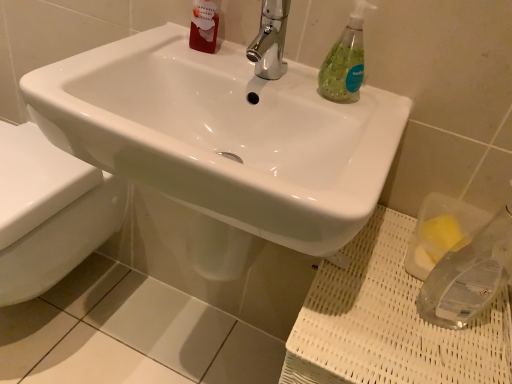
Describe the element at coordinates (389, 322) in the screenshot. I see `clear plastic sponge at lower right` at that location.

Identify the location of translucent red liquid at upper left. (204, 25).

In order to click on white glossy toilet at lower left in this screenshot , I will do `click(49, 212)`.

From a real-world perspective, is clear plastic sponge at lower right above or below chrome metallic faucet at upper center?

From a real-world perspective, clear plastic sponge at lower right is physically below chrome metallic faucet at upper center.

In terms of size, does clear plastic sponge at lower right appear bigger or smaller than chrome metallic faucet at upper center?

Clearly, clear plastic sponge at lower right is larger in size than chrome metallic faucet at upper center.

Considering the sizes of objects clear plastic sponge at lower right and chrome metallic faucet at upper center in the image provided, who is wider, clear plastic sponge at lower right or chrome metallic faucet at upper center?

clear plastic sponge at lower right is wider.

From the image's perspective, is clear plastic sponge at lower right under chrome metallic faucet at upper center?

Correct, clear plastic sponge at lower right appears lower than chrome metallic faucet at upper center in the image.

Can you tell me how much white glossy toilet at lower left and green translucent soap dispenser at upper right differ in facing direction?

The facing directions of white glossy toilet at lower left and green translucent soap dispenser at upper right are 0.241 degrees apart.

Is point (73, 256) closer or farther from the camera than point (355, 38)?

Point (73, 256).

Can you confirm if white glossy toilet at lower left is bigger than green translucent soap dispenser at upper right?

Yes, white glossy toilet at lower left is bigger than green translucent soap dispenser at upper right.

Is green translucent soap dispenser at upper right at the back of white glossy toilet at lower left?

No, white glossy toilet at lower left is not facing away from green translucent soap dispenser at upper right.

Is there a large distance between white glossy toilet at lower left and clear plastic sponge at lower right?

white glossy toilet at lower left is near clear plastic sponge at lower right, not far away.

Where is `toilet that is under the clear plastic sponge at lower right (from a real-world perspective)`? toilet that is under the clear plastic sponge at lower right (from a real-world perspective) is located at coordinates (49, 212).

Can you confirm if white glossy toilet at lower left is bigger than clear plastic sponge at lower right?

Indeed, white glossy toilet at lower left has a larger size compared to clear plastic sponge at lower right.

From a real-world perspective, between white glossy sink at center and green translucent soap dispenser at upper right, who is vertically higher?

green translucent soap dispenser at upper right.

Which is behind, point (106, 137) or point (340, 79)?

Positioned behind is point (340, 79).

From the image's perspective, is white glossy sink at center below green translucent soap dispenser at upper right?

Yes.

Does white glossy sink at center appear on the left side of green translucent soap dispenser at upper right?

Yes, white glossy sink at center is to the left of green translucent soap dispenser at upper right.

Is white glossy sink at center looking in the opposite direction of translucent red liquid at upper left?

Answer: That's not correct — white glossy sink at center is not looking away from translucent red liquid at upper left.

Does white glossy sink at center have a greater height compared to translucent red liquid at upper left?

Correct, white glossy sink at center is much taller as translucent red liquid at upper left.

Based on their sizes in the image, would you say white glossy sink at center is bigger or smaller than translucent red liquid at upper left?

Clearly, white glossy sink at center is larger in size than translucent red liquid at upper left.

From a real-world perspective, which is physically below, green translucent soap dispenser at upper right or white glossy toilet at lower left?

white glossy toilet at lower left, from a real-world perspective.

Does green translucent soap dispenser at upper right appear on the left side of white glossy toilet at lower left?

No, green translucent soap dispenser at upper right is not to the left of white glossy toilet at lower left.

Between green translucent soap dispenser at upper right and white glossy toilet at lower left, which one has more height?

white glossy toilet at lower left.

Considering the relative sizes of green translucent soap dispenser at upper right and clear plastic sponge at lower right in the image provided, is green translucent soap dispenser at upper right wider than clear plastic sponge at lower right?

Incorrect, the width of green translucent soap dispenser at upper right does not surpass that of clear plastic sponge at lower right.

From the image's perspective, between green translucent soap dispenser at upper right and clear plastic sponge at lower right, which one is located above?

green translucent soap dispenser at upper right, from the image's perspective.

Is clear plastic sponge at lower right located within green translucent soap dispenser at upper right?

No.

Are green translucent soap dispenser at upper right and clear plastic sponge at lower right beside each other?

No, green translucent soap dispenser at upper right is not with clear plastic sponge at lower right.

Image resolution: width=512 pixels, height=384 pixels. In order to click on porcelain in front of the chrome metallic faucet at upper center in this screenshot , I will do `click(389, 322)`.

Locate an element on the screen. This screenshot has height=384, width=512. soap dispenser above the white glossy toilet at lower left (from a real-world perspective) is located at coordinates (345, 60).

Which object lies nearer to the anchor point white glossy sink at center, translucent red liquid at upper left or clear plastic sponge at lower right?

translucent red liquid at upper left is positioned closer to the anchor white glossy sink at center.

When comparing their distances from white glossy toilet at lower left, does white glossy sink at center or chrome metallic faucet at upper center seem further?

The object further to white glossy toilet at lower left is chrome metallic faucet at upper center.

From the image, which object appears to be nearer to chrome metallic faucet at upper center, clear plastic sponge at lower right or green translucent soap dispenser at upper right?

Based on the image, green translucent soap dispenser at upper right appears to be nearer to chrome metallic faucet at upper center.

Consider the image. Looking at the image, which one is located closer to chrome metallic faucet at upper center, translucent red liquid at upper left or white glossy toilet at lower left?

Among the two, translucent red liquid at upper left is located nearer to chrome metallic faucet at upper center.

Which object lies further to the anchor point chrome metallic faucet at upper center, green translucent soap dispenser at upper right or clear plastic sponge at lower right?

The object further to chrome metallic faucet at upper center is clear plastic sponge at lower right.

Which object lies further to the anchor point chrome metallic faucet at upper center, green translucent soap dispenser at upper right or translucent red liquid at upper left?

Among the two, translucent red liquid at upper left is located further to chrome metallic faucet at upper center.

Estimate the real-world distances between objects in this image. Which object is closer to white glossy sink at center, white glossy toilet at lower left or green translucent soap dispenser at upper right?

Among the two, green translucent soap dispenser at upper right is located nearer to white glossy sink at center.

In the scene shown: Based on their spatial positions, is chrome metallic faucet at upper center or white glossy sink at center closer to white glossy toilet at lower left?

Among the two, white glossy sink at center is located nearer to white glossy toilet at lower left.

Locate an element on the screen. Image resolution: width=512 pixels, height=384 pixels. toiletry between white glossy toilet at lower left and clear plastic sponge at lower right in the horizontal direction is located at coordinates [204, 25].

This screenshot has width=512, height=384. I want to click on sink situated between white glossy toilet at lower left and green translucent soap dispenser at upper right from left to right, so click(224, 135).

Identify the location of tap between translucent red liquid at upper left and green translucent soap dispenser at upper right from left to right. (270, 40).

Locate an element on the screen. This screenshot has height=384, width=512. soap dispenser between white glossy toilet at lower left and clear plastic sponge at lower right is located at coordinates 345,60.